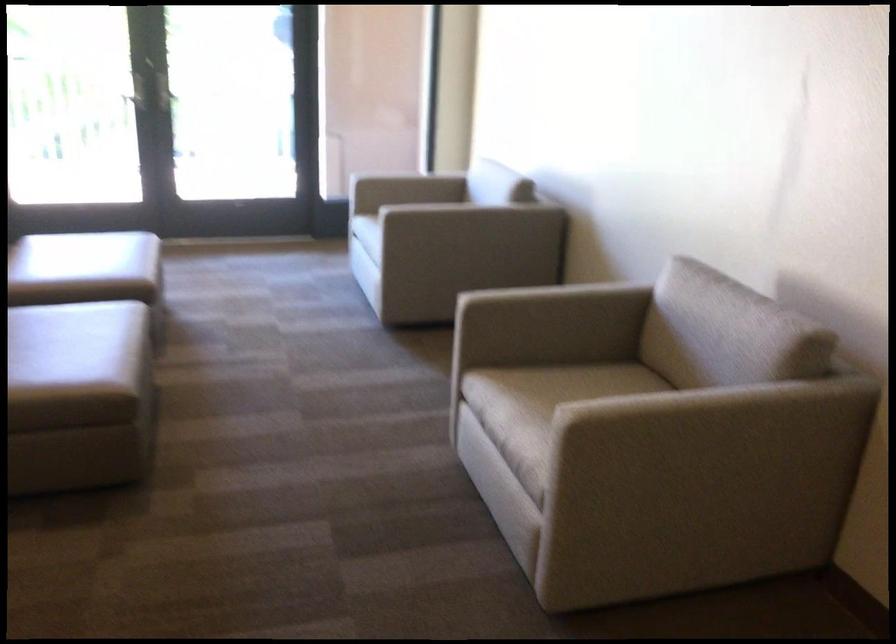
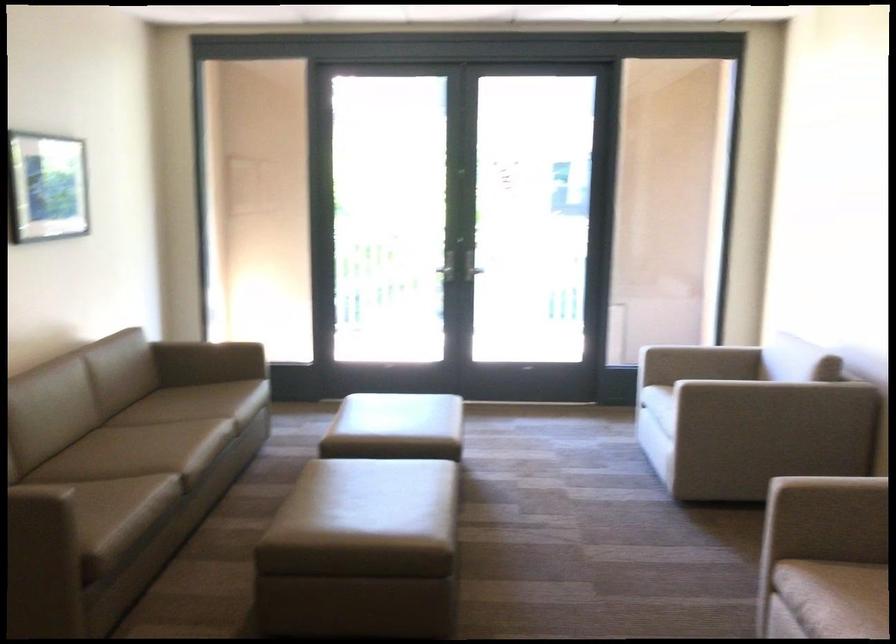
The point at (470, 209) is marked in the first image. Where is the corresponding point in the second image?

(774, 392)